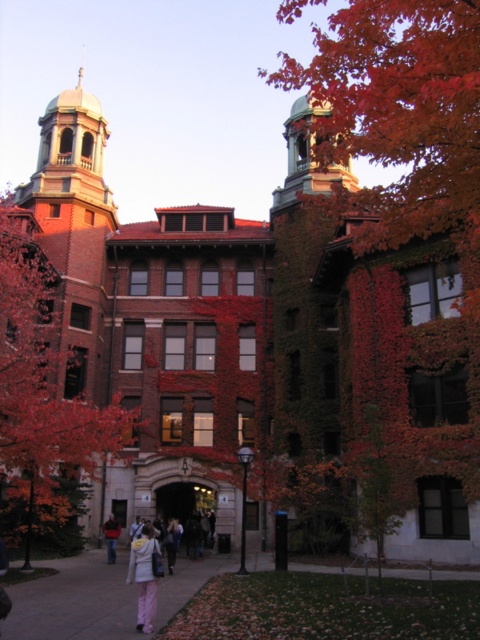
Based on the photo, you are a delivery person carrying a package and need to walk from the left side of the image to the right side. You see the paved concrete sidewalk at center and the dark gray jacket at center. Which object should you step on to avoid getting your shoes dirty?

You should step on the paved concrete sidewalk at center because it has a larger size compared to the dark gray jacket at center, making it more suitable for walking on without damaging the jacket.

Consider the image. You are standing on the paved concrete sidewalk at center and want to pick up the dark gray jacket at center. Is the jacket on the sidewalk or above it?

The dark gray jacket at center is above the paved concrete sidewalk at center, so you need to reach up to pick it up.